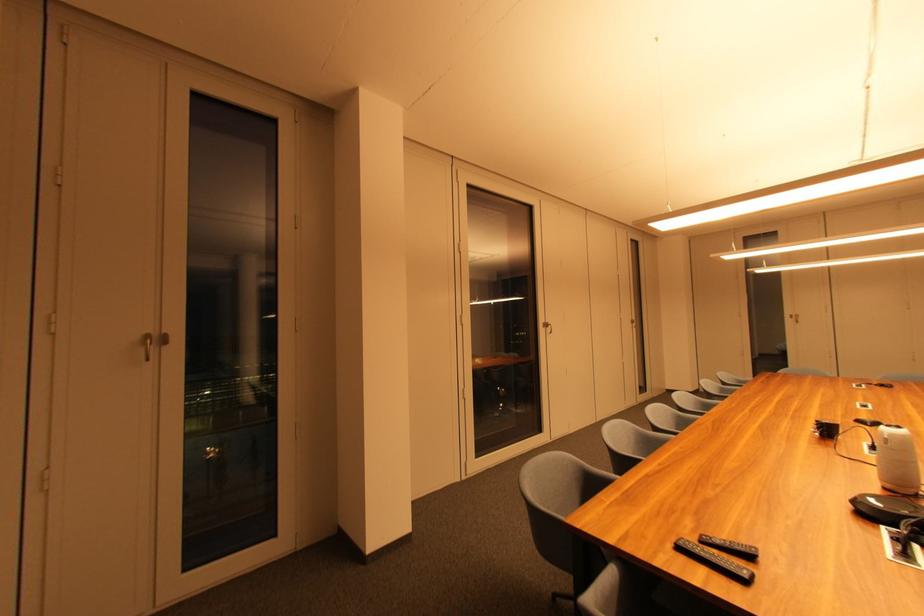
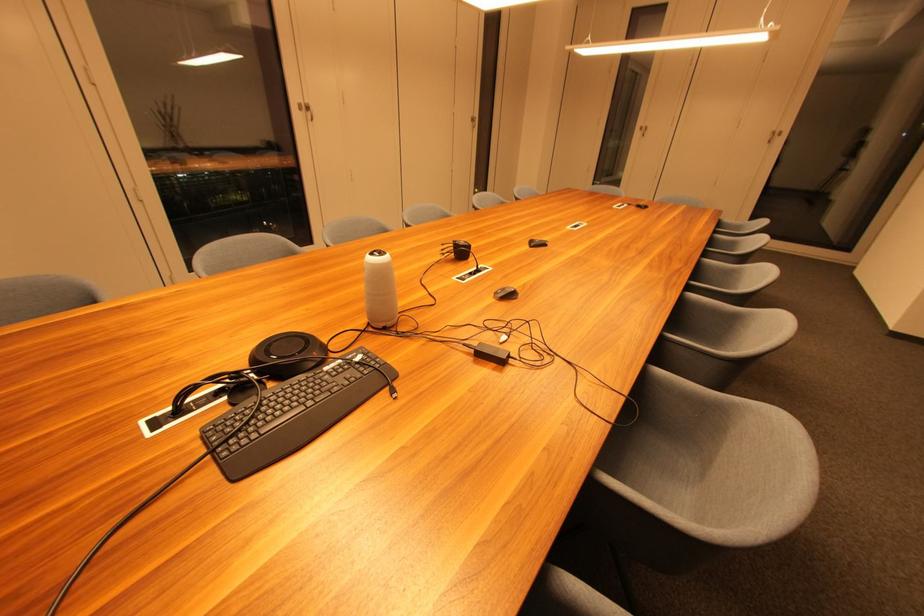
Find the pixel in the second image that matches pixel 549 329 in the first image.

(306, 111)